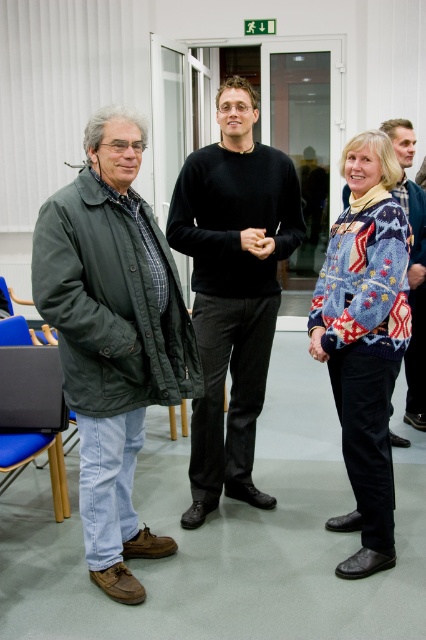
Question: Considering the real-world distances, which object is farthest from the black smooth sweater at center?

Choices:
 (A) knitted sweater at center
 (B) green canvas jacket at left

Answer: (A)

Question: Is green canvas jacket at left above knitted sweater at center?

Choices:
 (A) no
 (B) yes

Answer: (A)

Question: Which point is farther from the camera taking this photo?

Choices:
 (A) (412, 380)
 (B) (382, 144)
 (C) (135, 356)
 (D) (204, 460)

Answer: (A)

Question: Is green canvas jacket at left thinner than black smooth sweater at center?

Choices:
 (A) no
 (B) yes

Answer: (B)

Question: Which of the following is the closest to the observer?

Choices:
 (A) (227, 467)
 (B) (86, 348)

Answer: (B)

Question: Considering the relative positions of black smooth sweater at center and blue knitted sweater at center in the image provided, where is black smooth sweater at center located with respect to blue knitted sweater at center?

Choices:
 (A) left
 (B) right

Answer: (A)